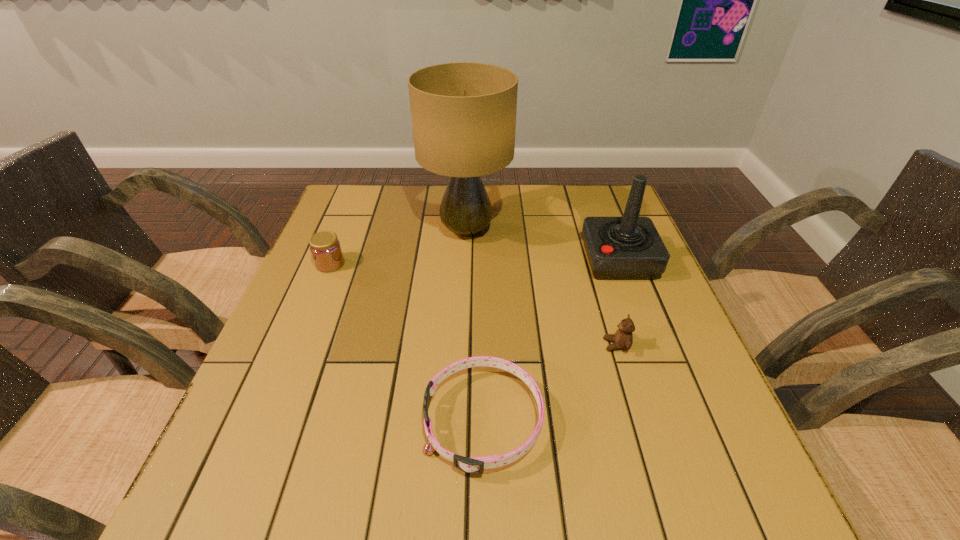
Image resolution: width=960 pixels, height=540 pixels. I want to click on free spot between the joystick and the second nearest object, so (618, 302).

Find the location of `free space that is in between the joystick and the nearest object`. free space that is in between the joystick and the nearest object is located at coordinates (551, 340).

At what (x,y) coordinates should I click in order to perform the action: click on free space between the teddy bear and the nearest object. Please return your answer as a coordinate pair (x, y). This screenshot has width=960, height=540. Looking at the image, I should click on [550, 383].

Identify the location of blank region between the teddy bear and the tallest object. The width and height of the screenshot is (960, 540). (541, 288).

Find the location of a particular element. empty space that is in between the lampshade and the second tallest object is located at coordinates (542, 245).

This screenshot has width=960, height=540. In order to click on vacant area that lies between the teddy bear and the joystick in this screenshot , I will do 618,302.

I want to click on unoccupied position between the second tallest object and the nearest object, so click(x=551, y=340).

The height and width of the screenshot is (540, 960). I want to click on vacant point located between the lampshade and the leftmost object, so click(398, 247).

Point out which object is positioned as the third nearest to the fourth shortest object. Please provide its 2D coordinates. Your answer should be formatted as a tuple, i.e. [(x, y)], where the tuple contains the x and y coordinates of a point satisfying the conditions above.

[(474, 465)]

You are a GUI agent. You are given a task and a screenshot of the screen. Output one action in this format:
    pyautogui.click(x=<x>, y=<y>)
    Task: Click on the object that is the closest to the fourth farthest object
    The image size is (960, 540).
    Given the screenshot: What is the action you would take?
    pyautogui.click(x=474, y=465)